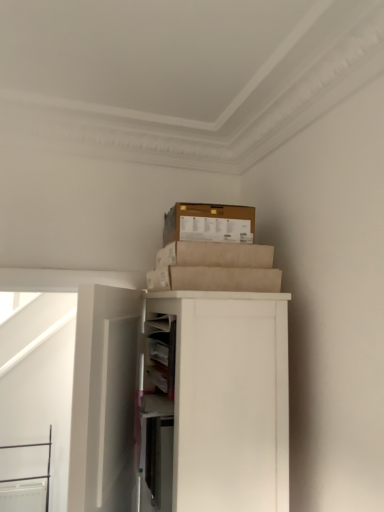
Question: Would you say white matte cabinet at upper right is a long distance from white matte door at left?

Choices:
 (A) no
 (B) yes

Answer: (A)

Question: From the image's perspective, is white matte cabinet at upper right under white matte door at left?

Choices:
 (A) yes
 (B) no

Answer: (B)

Question: Is white matte cabinet at upper right taller than white matte door at left?

Choices:
 (A) no
 (B) yes

Answer: (A)

Question: Is white matte cabinet at upper right thinner than white matte door at left?

Choices:
 (A) yes
 (B) no

Answer: (B)

Question: Does white matte cabinet at upper right have a smaller size compared to white matte door at left?

Choices:
 (A) no
 (B) yes

Answer: (A)

Question: Considering the positions of brown cardboard box at upper center and white matte cabinet at upper right in the image, is brown cardboard box at upper center taller or shorter than white matte cabinet at upper right?

Choices:
 (A) short
 (B) tall

Answer: (A)

Question: Based on their sizes in the image, would you say brown cardboard box at upper center is bigger or smaller than white matte cabinet at upper right?

Choices:
 (A) small
 (B) big

Answer: (A)

Question: Relative to white matte cabinet at upper right, is brown cardboard box at upper center in front or behind?

Choices:
 (A) behind
 (B) front

Answer: (A)

Question: From a real-world perspective, is brown cardboard box at upper center physically located above or below white matte cabinet at upper right?

Choices:
 (A) above
 (B) below

Answer: (A)

Question: Which is correct: brown cardboard box at upper center is inside white matte door at left, or outside of it?

Choices:
 (A) outside
 (B) inside

Answer: (A)

Question: Considering the positions of brown cardboard box at upper center and white matte door at left in the image, is brown cardboard box at upper center taller or shorter than white matte door at left?

Choices:
 (A) tall
 (B) short

Answer: (B)

Question: Considering their positions, is brown cardboard box at upper center located in front of or behind white matte door at left?

Choices:
 (A) front
 (B) behind

Answer: (B)

Question: From a real-world perspective, relative to white matte door at left, is brown cardboard box at upper center vertically above or below?

Choices:
 (A) below
 (B) above

Answer: (B)

Question: Looking at the image, does white matte door at left seem bigger or smaller compared to white matte cabinet at upper right?

Choices:
 (A) small
 (B) big

Answer: (A)

Question: Is white matte door at left spatially inside white matte cabinet at upper right, or outside of it?

Choices:
 (A) outside
 (B) inside

Answer: (A)